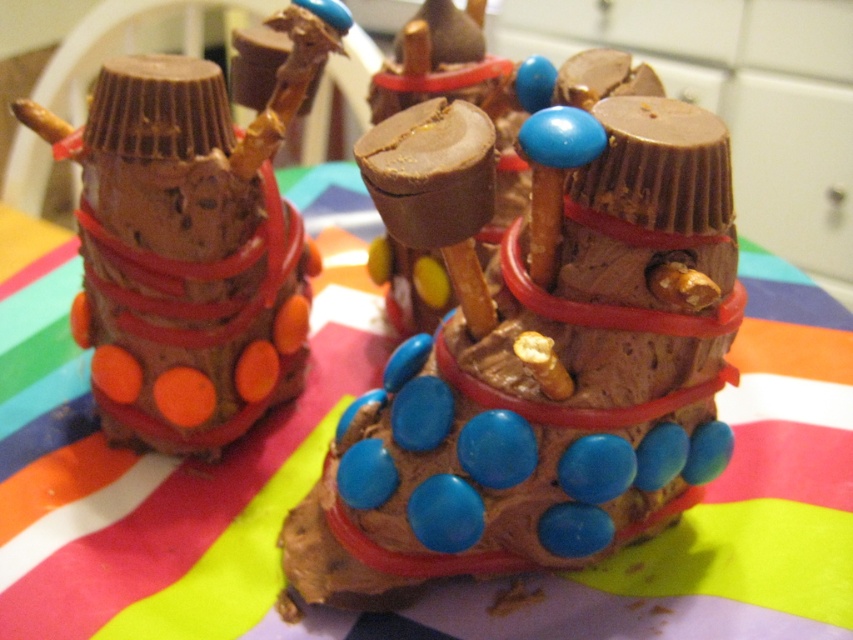
You are a customer at a bakery and see two chocolate boots on a table. You want to take a photo of the blue chocolate candy at center and the multicolored fabric at center. Which one will appear larger in your photo?

The blue chocolate candy at center will appear larger in the photo because it is closer to the viewer than the multicolored fabric at center.

You are a customer at a chocolate shop and see two boots made of chocolate. The first boot has blue chocolate candy at center and matte chocolate candy at left. Which one is more to the right?

The blue chocolate candy at center is more to the right than the matte chocolate candy at left.

You are a customer at a bakery and see two chocolate boots on a table. The boots are decorated with blue chocolate candy at center and multicolored fabric at center. Which decoration is positioned to the right of the other?

The blue chocolate candy at center is to the right of the multicolored fabric at center.